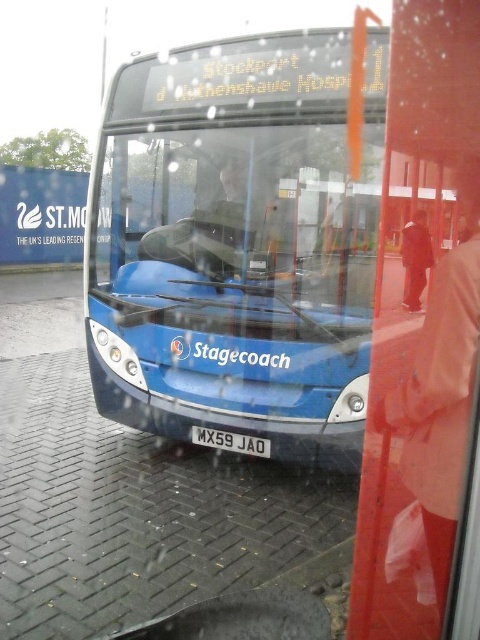
Which is above, blue metallic bus at center or transparent glass at center?

transparent glass at center is above.

Which is behind, point (169, 164) or point (371, 289)?

Positioned behind is point (169, 164).

Identify the location of blue metallic bus at center. The image size is (480, 640). (237, 243).

Can you confirm if blue metallic bus at center is smaller than white plastic license plate at center?

No.

Who is more distant from viewer, (160, 196) or (245, 445)?

The point (160, 196) is behind.

Identify the location of blue metallic bus at center. The image size is (480, 640). (237, 243).

Which is above, transparent glass at center or white plastic license plate at center?

Positioned higher is transparent glass at center.

Does point (115, 237) lie behind point (228, 445)?

Yes, it is.

The width and height of the screenshot is (480, 640). What do you see at coordinates (237, 220) in the screenshot?
I see `transparent glass at center` at bounding box center [237, 220].

At what (x,y) coordinates should I click in order to perform the action: click on transparent glass at center. Please return your answer as a coordinate pair (x, y). Looking at the image, I should click on (237, 220).